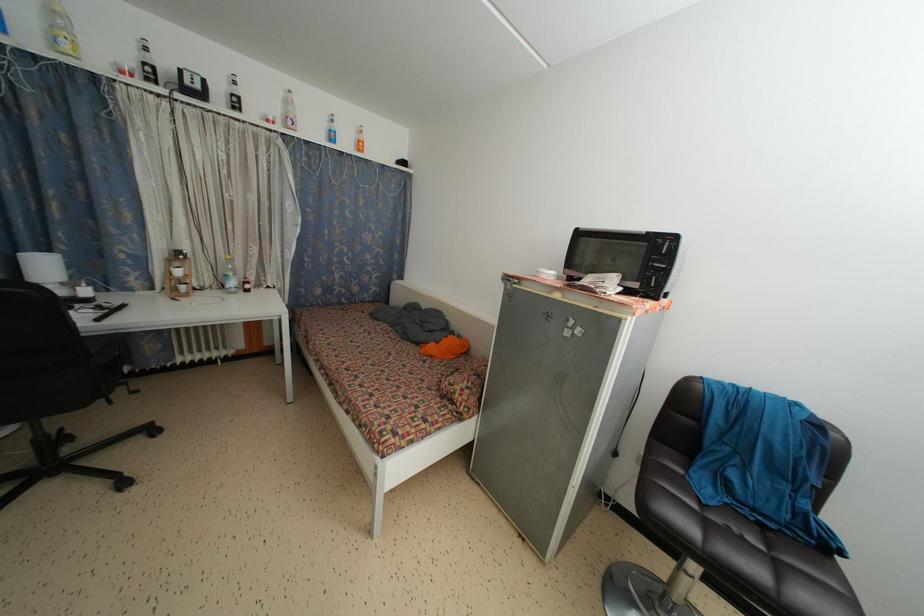
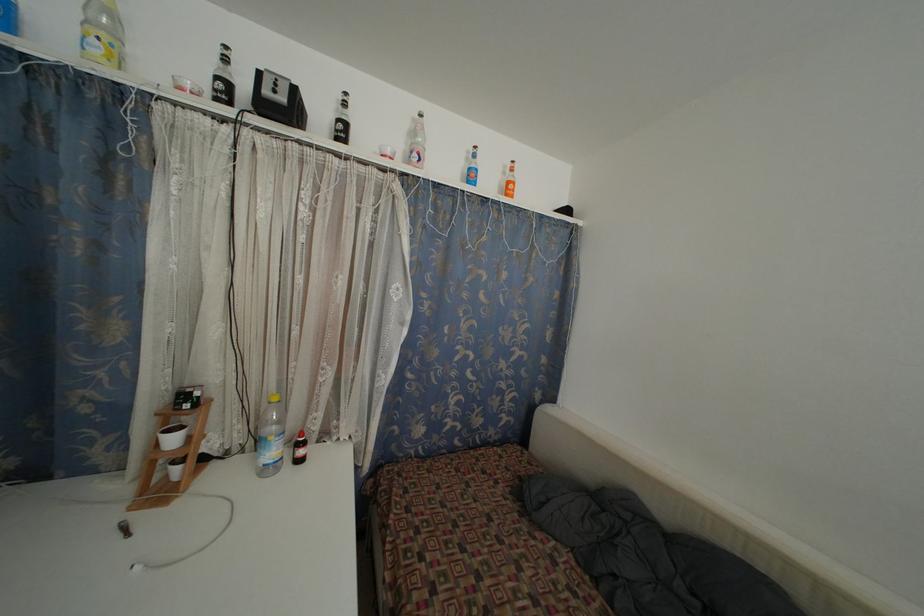
Locate, in the second image, the point that corresponds to (x=185, y=77) in the first image.

(263, 79)